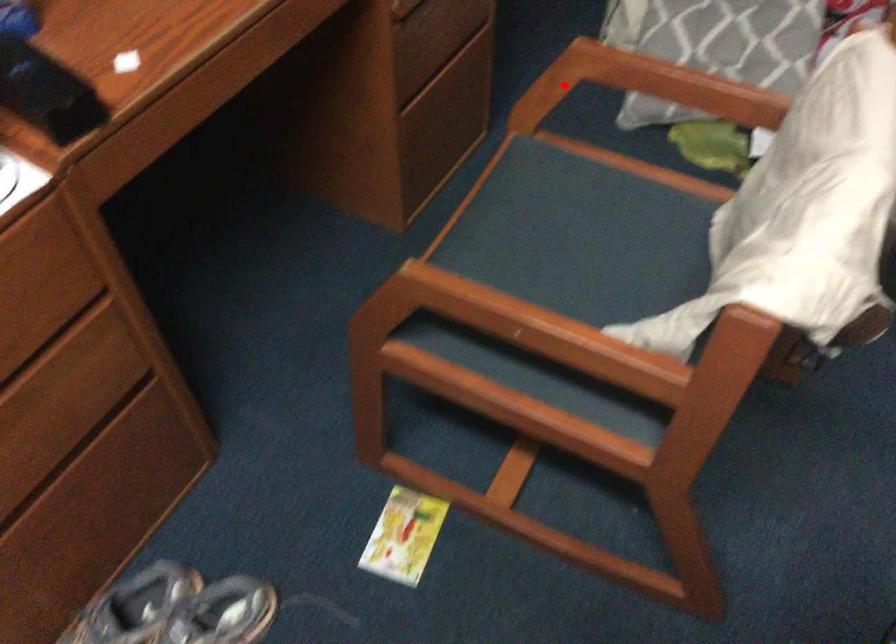
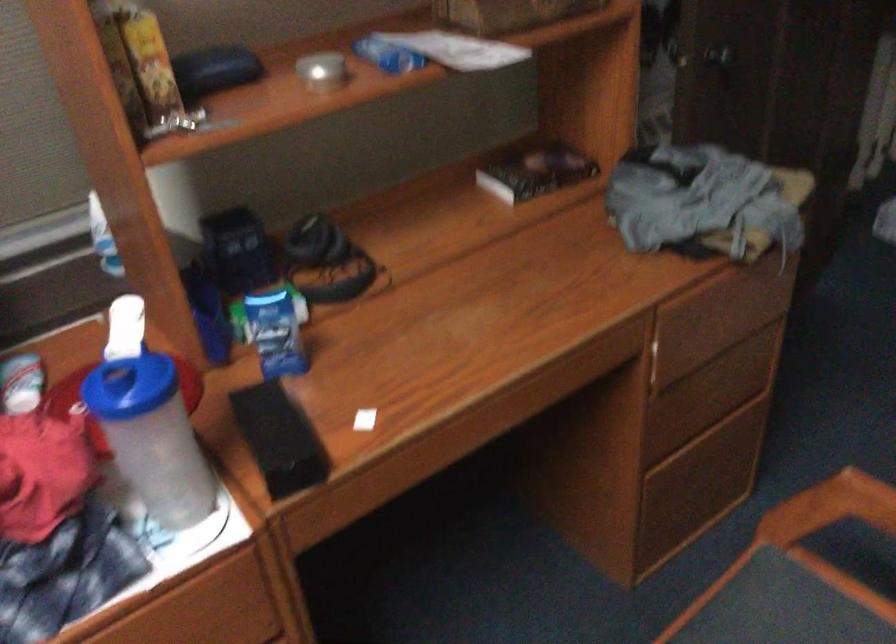
Question: I am providing you with two images of the same scene from different viewpoints. A red point is marked on the first image. Can you still see the location of the red point in image 2?

Choices:
 (A) Yes
 (B) No

Answer: (A)